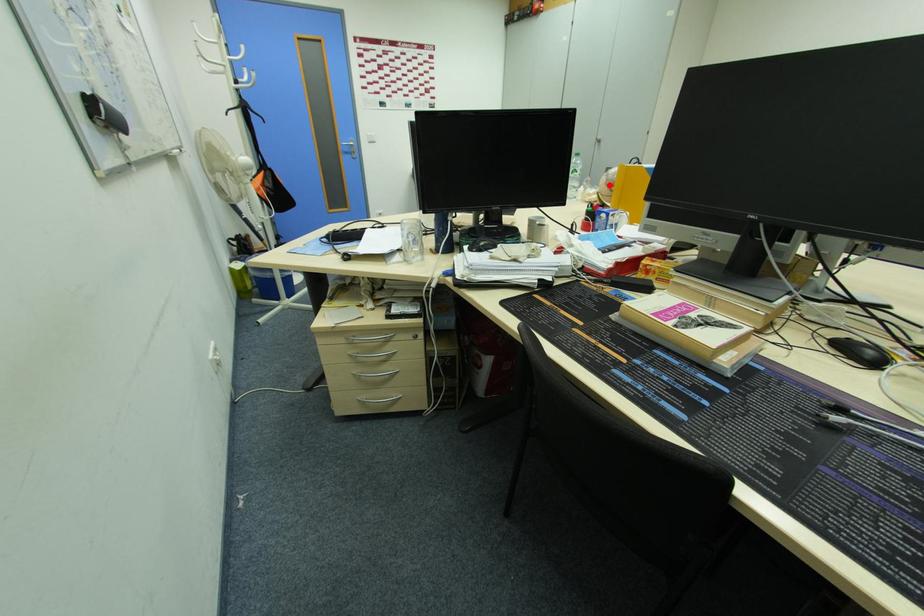
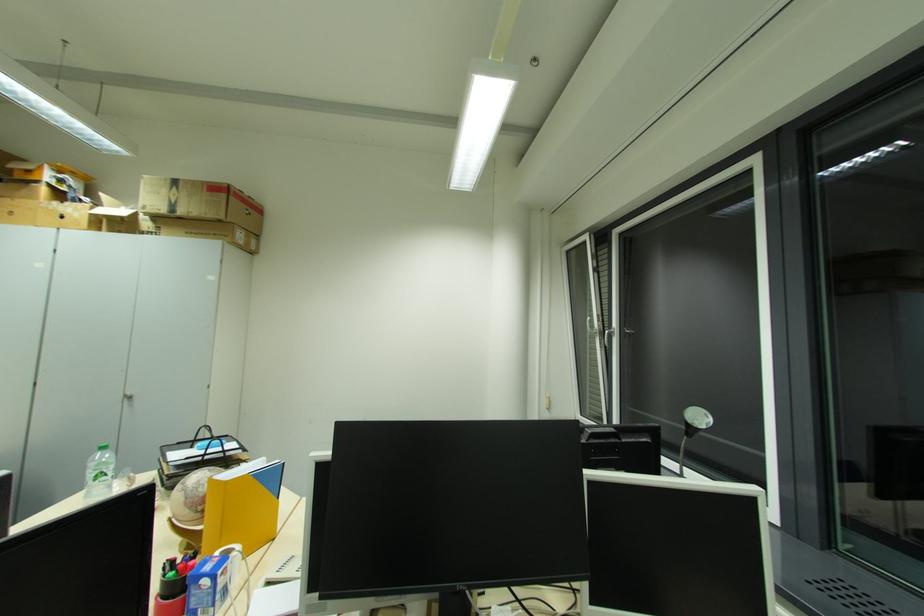
Locate, in the second image, the point that corresponds to the highlighted location in the first image.

(189, 506)